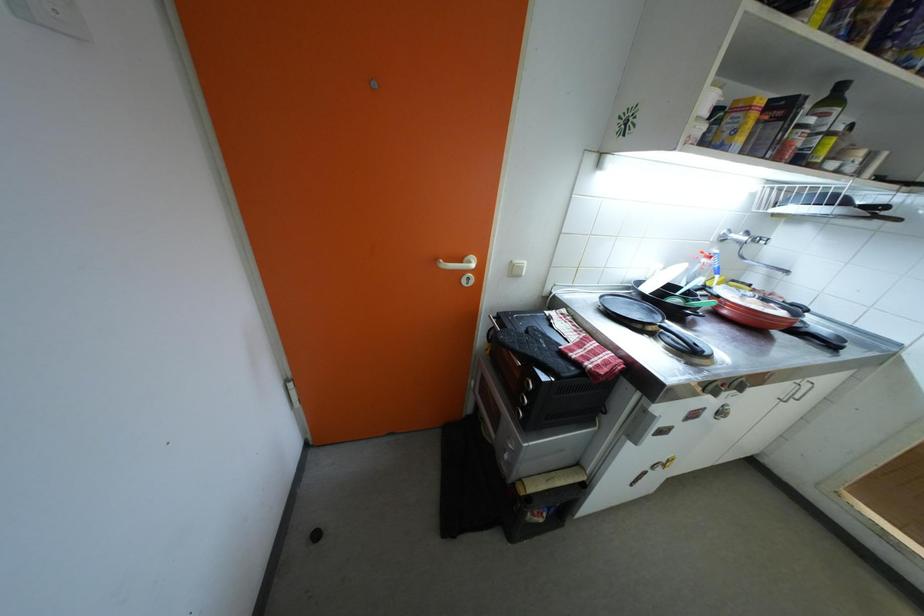
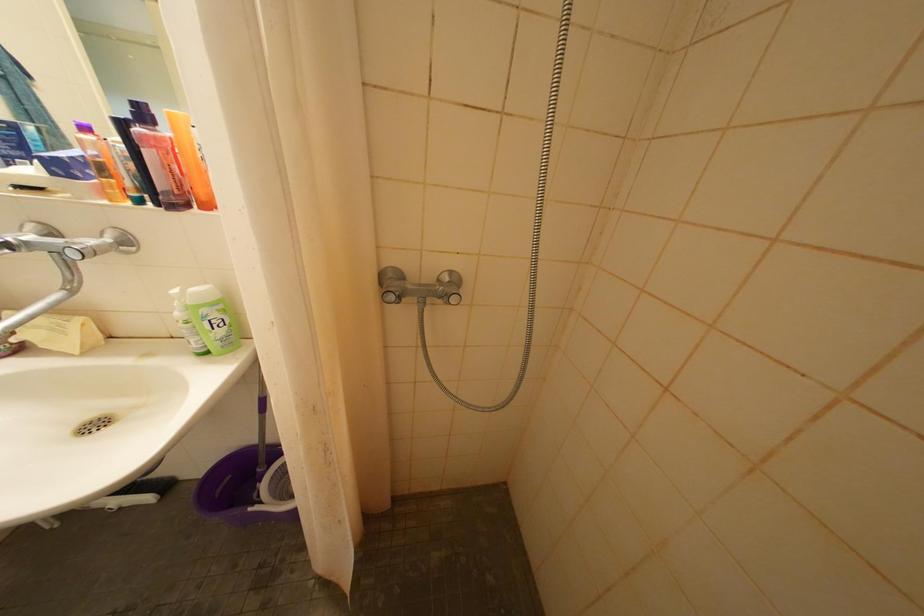
Question: In a continuous first-person perspective shot, in which direction is the camera moving?

Choices:
 (A) Left
 (B) Right
 (C) Forward
 (D) Backward

Answer: (B)